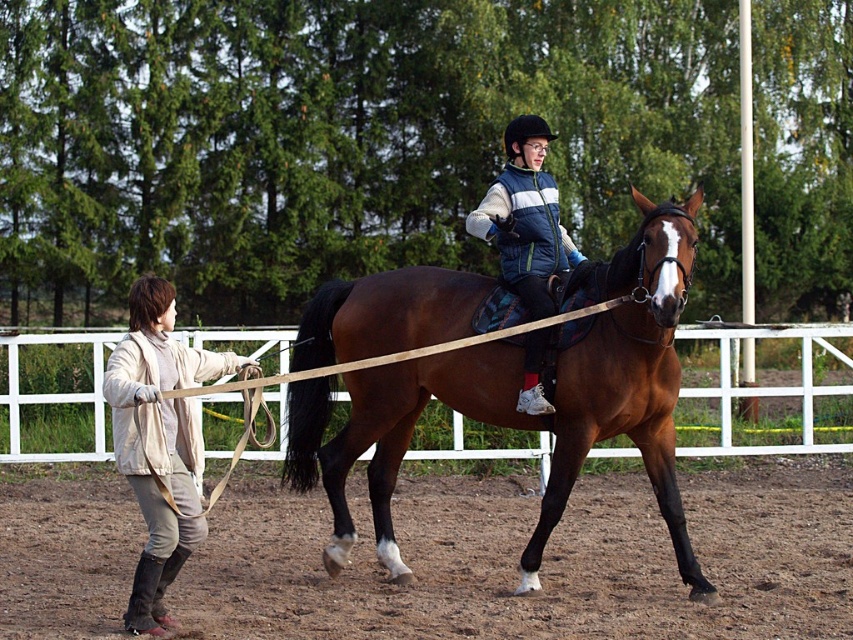
You are a photographer trying to capture the brown glossy horse at center in the equestrian scene. The arena is surrounded by a white fence. You want to position your camera at the point marked by the coordinates point (519, 412). Will this position allow you to see the brown glossy horse at center clearly?

The point (519, 412) indicates brown glossy horse at center, so yes, positioning the camera at this point will allow you to see the brown glossy horse at center clearly.

You are a photographer trying to capture a clear photo of the brown glossy horse at center and the light beige fabric jacket at left. However, you notice that the horse is blocking the view of the jacket. Can you adjust your position to see both subjects without obstruction?

The brown glossy horse at center is positioned over light beige fabric jacket at left, so moving to the right side of the scene would allow you to see both subjects without the horse obstructing the view of the jacket.